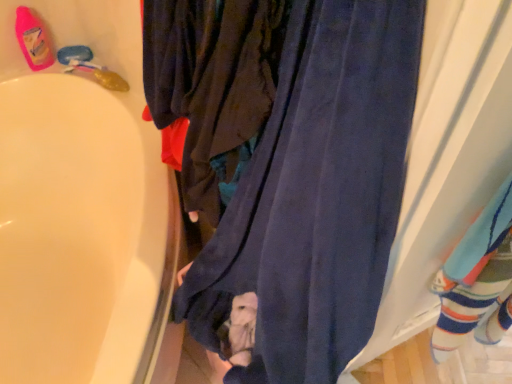
This screenshot has height=384, width=512. Describe the element at coordinates (212, 85) in the screenshot. I see `velvet-like dark blue pants at center` at that location.

Identify the location of striped cotton socks at right. This screenshot has width=512, height=384. (477, 280).

Where is `pink plastic bottle at upper left`? pink plastic bottle at upper left is located at coordinates (33, 39).

Locate an element on the screen. This screenshot has width=512, height=384. curtain below the velvet-like dark blue pants at center (from a real-world perspective) is located at coordinates (316, 196).

Based on their sizes in the image, would you say navy blue fabric at center is bigger or smaller than velvet-like dark blue pants at center?

Clearly, navy blue fabric at center is larger in size than velvet-like dark blue pants at center.

Can you confirm if navy blue fabric at center is thinner than velvet-like dark blue pants at center?

Incorrect, the width of navy blue fabric at center is not less than that of velvet-like dark blue pants at center.

From the image's perspective, is navy blue fabric at center positioned above or below velvet-like dark blue pants at center?

navy blue fabric at center is below velvet-like dark blue pants at center.

From a real-world perspective, is velvet-like dark blue pants at center above or below navy blue fabric at center?

velvet-like dark blue pants at center is above navy blue fabric at center.

Does velvet-like dark blue pants at center have a lesser width compared to navy blue fabric at center?

Correct, the width of velvet-like dark blue pants at center is less than that of navy blue fabric at center.

Is velvet-like dark blue pants at center touching navy blue fabric at center?

No, velvet-like dark blue pants at center is not making contact with navy blue fabric at center.

Does point (214, 220) appear closer or farther from the camera than point (268, 125)?

Point (214, 220) is farther from the camera than point (268, 125).

Can you confirm if striped cotton socks at right is thinner than velvet-like dark blue pants at center?

Correct, the width of striped cotton socks at right is less than that of velvet-like dark blue pants at center.

In terms of height, does striped cotton socks at right look taller or shorter compared to velvet-like dark blue pants at center?

Considering their sizes, striped cotton socks at right has more height than velvet-like dark blue pants at center.

From a real-world perspective, which is physically above, striped cotton socks at right or velvet-like dark blue pants at center?

velvet-like dark blue pants at center, from a real-world perspective.

Is striped cotton socks at right at the left side of velvet-like dark blue pants at center?

In fact, striped cotton socks at right is to the right of velvet-like dark blue pants at center.

Would you say velvet-like dark blue pants at center is outside striped cotton socks at right?

Yes, velvet-like dark blue pants at center is not within striped cotton socks at right.

Consider the image. Considering the relative positions of velvet-like dark blue pants at center and striped cotton socks at right in the image provided, is velvet-like dark blue pants at center to the right of striped cotton socks at right from the viewer's perspective?

No.

Where is `bath towel below the velvet-like dark blue pants at center (from the image's perspective)`? bath towel below the velvet-like dark blue pants at center (from the image's perspective) is located at coordinates (477, 280).

Could you tell me if velvet-like dark blue pants at center is turned towards striped cotton socks at right?

No.

Where is `curtain in front of the striped cotton socks at right`? The image size is (512, 384). curtain in front of the striped cotton socks at right is located at coordinates (316, 196).

From the image's perspective, is striped cotton socks at right on navy blue fabric at center?

No, from the image's perspective, striped cotton socks at right is not on top of navy blue fabric at center.

Which is behind, point (506, 327) or point (303, 380)?

Point (506, 327)

Looking at their sizes, would you say striped cotton socks at right is wider or thinner than navy blue fabric at center?

In the image, striped cotton socks at right appears to be more narrow than navy blue fabric at center.

Is velvet-like dark blue pants at center bigger or smaller than pink plastic bottle at upper left?

Considering their sizes, velvet-like dark blue pants at center takes up more space than pink plastic bottle at upper left.

Consider the image. Would you say velvet-like dark blue pants at center is inside or outside pink plastic bottle at upper left?

velvet-like dark blue pants at center is outside pink plastic bottle at upper left.

Is velvet-like dark blue pants at center placed right next to pink plastic bottle at upper left?

No, velvet-like dark blue pants at center is not making contact with pink plastic bottle at upper left.

Where is `footwear below the velvet-like dark blue pants at center (from a real-world perspective)`? footwear below the velvet-like dark blue pants at center (from a real-world perspective) is located at coordinates (33, 39).

Looking at this image, from the image's perspective, which one is positioned lower, striped cotton socks at right or pink plastic bottle at upper left?

striped cotton socks at right appears lower in the image.

Is striped cotton socks at right taller or shorter than pink plastic bottle at upper left?

Considering their sizes, striped cotton socks at right has more height than pink plastic bottle at upper left.

Is striped cotton socks at right facing away from pink plastic bottle at upper left?

That's not correct — striped cotton socks at right is not looking away from pink plastic bottle at upper left.

Locate an element on the screen. The image size is (512, 384). curtain directly beneath the velvet-like dark blue pants at center (from a real-world perspective) is located at coordinates (316, 196).

Identify the location of curtain that is in front of the velvet-like dark blue pants at center. The height and width of the screenshot is (384, 512). (316, 196).

Looking at this image, looking at the image, which one is located further to velvet-like dark blue pants at center, striped cotton socks at right or navy blue fabric at center?

Based on the image, striped cotton socks at right appears to be further to velvet-like dark blue pants at center.

Looking at the image, which one is located further to velvet-like dark blue pants at center, navy blue fabric at center or pink plastic bottle at upper left?

Among the two, pink plastic bottle at upper left is located further to velvet-like dark blue pants at center.

Which object lies further to the anchor point navy blue fabric at center, velvet-like dark blue pants at center or striped cotton socks at right?

The object further to navy blue fabric at center is striped cotton socks at right.

Estimate the real-world distances between objects in this image. Which object is closer to striped cotton socks at right, navy blue fabric at center or pink plastic bottle at upper left?

Based on the image, navy blue fabric at center appears to be nearer to striped cotton socks at right.

Estimate the real-world distances between objects in this image. Which object is further from striped cotton socks at right, pink plastic bottle at upper left or navy blue fabric at center?

The object further to striped cotton socks at right is pink plastic bottle at upper left.

Estimate the real-world distances between objects in this image. Which object is further from navy blue fabric at center, striped cotton socks at right or pink plastic bottle at upper left?

pink plastic bottle at upper left lies further to navy blue fabric at center than the other object.

From the image, which object appears to be nearer to striped cotton socks at right, pink plastic bottle at upper left or velvet-like dark blue pants at center?

The object closer to striped cotton socks at right is velvet-like dark blue pants at center.

When comparing their distances from pink plastic bottle at upper left, does navy blue fabric at center or striped cotton socks at right seem further?

striped cotton socks at right is positioned further to the anchor pink plastic bottle at upper left.

The height and width of the screenshot is (384, 512). In order to click on clothing between navy blue fabric at center and pink plastic bottle at upper left from front to back in this screenshot , I will do `click(212, 85)`.

You are a GUI agent. You are given a task and a screenshot of the screen. Output one action in this format:
    pyautogui.click(x=<x>, y=<y>)
    Task: Click on the curtain located between pink plastic bottle at upper left and striped cotton socks at right in the left-right direction
    This screenshot has height=384, width=512.
    Given the screenshot: What is the action you would take?
    pyautogui.click(x=316, y=196)

The image size is (512, 384). In order to click on clothing between pink plastic bottle at upper left and striped cotton socks at right from left to right in this screenshot , I will do `click(212, 85)`.

Find the location of a particular element. The height and width of the screenshot is (384, 512). curtain situated between velvet-like dark blue pants at center and striped cotton socks at right from left to right is located at coordinates (316, 196).